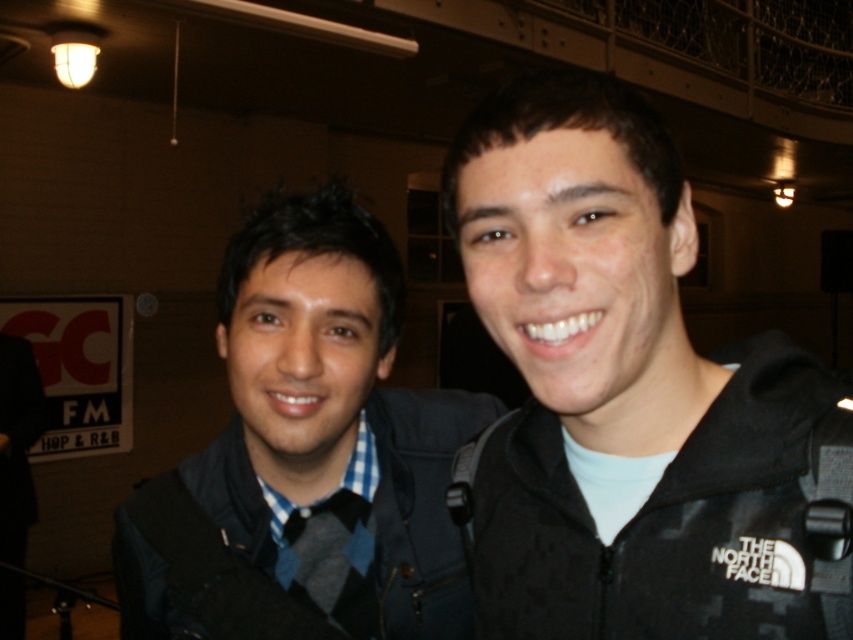
You are at a social event and want to take a photo of the blue checkered shirt at center. The camera you have can only focus on objects within a 0.2 radius around the point specified. Is the blue checkered shirt at center within the focus range of the camera set to point (310, 449)?

The point (310, 449) corresponds to the blue checkered shirt at center, so yes, the camera will focus on it.

You are a photographer setting up for an event. You need to ensure that the blue checkered shirt at center and the black fabric jacket at right are both visible in the frame. Given their sizes, which one might require more space in the camera frame?

The blue checkered shirt at center has a larger size compared to the black fabric jacket at right, so it would require more space in the camera frame to fully capture its details.

Consider the image. You are a photographer holding a camera. You want to capture a clear photo of the blue checkered shirt at center. Considering the distance between the camera and the shirt, is the camera close enough to take a sharp photo without needing a flash?

The blue checkered shirt at center and camera are 23.68 inches apart from each other. At this distance, the camera should be close enough to capture a sharp photo without needing a flash.